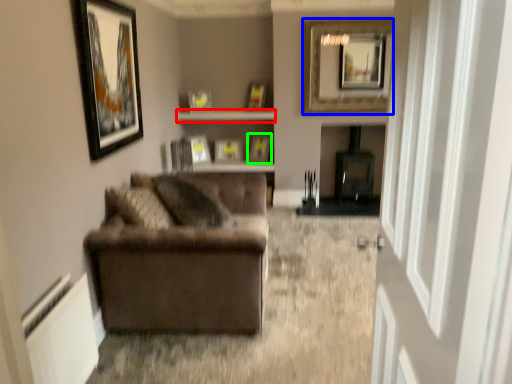
Question: Estimate the real-world distances between objects in this image. Which object is farther from shelf (highlighted by a red box), picture frame (highlighted by a blue box) or picture frame (highlighted by a green box)?

Choices:
 (A) picture frame
 (B) picture frame

Answer: (A)